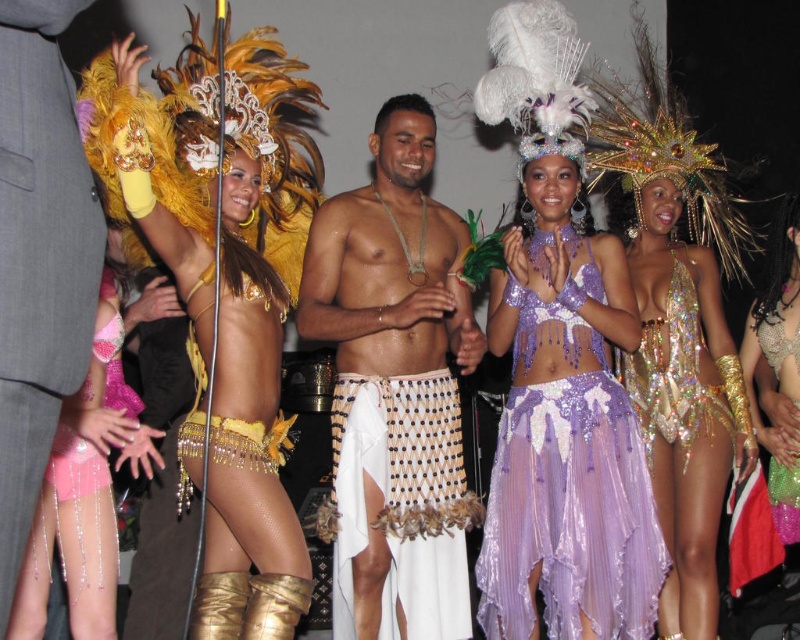
You are a photographer at the event and want to capture a photo of both the shiny gold skirt at center and the purple sequined dress at center without any obstruction. Based on their positions, which one should you focus on first to ensure both are visible?

The shiny gold skirt at center is in front of the purple sequined dress at center, so you should focus on the purple sequined dress at center first to ensure both are visible without obstruction.